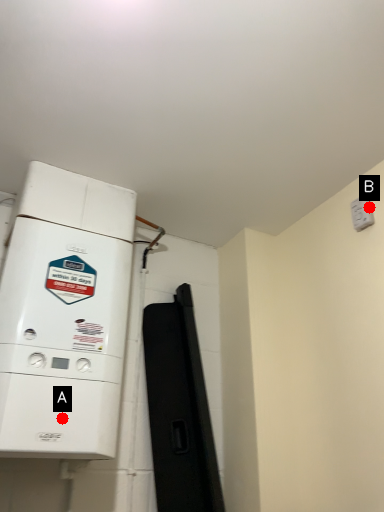
Question: Two points are circled on the image, labeled by A and B beside each circle. Which point is closer to the camera?

Choices:
 (A) A is closer
 (B) B is closer

Answer: (A)